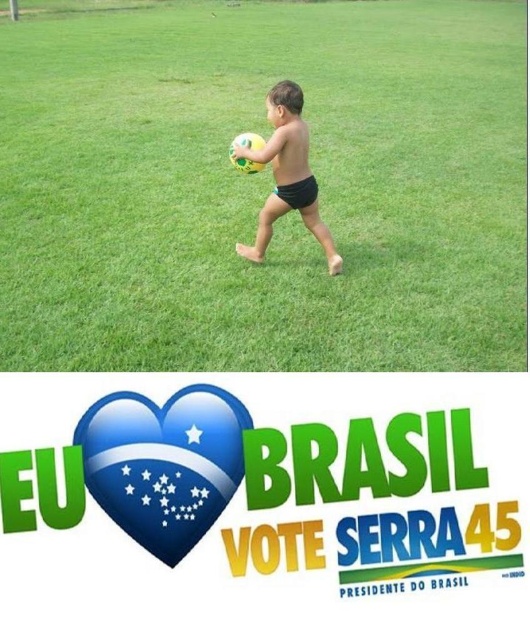
Where is `green grass at center`? Image resolution: width=530 pixels, height=640 pixels. green grass at center is located at coordinates (263, 188).

Is point (416, 262) positioned before point (200, 480)?

No, (416, 262) is further to viewer.

At what (x,y) coordinates should I click in order to perform the action: click on green grass at center. Please return your answer as a coordinate pair (x, y). Looking at the image, I should click on (263, 188).

Is point (196, 420) positioned in front of point (290, 106)?

Yes, point (196, 420) is in front of point (290, 106).

The image size is (530, 640). What do you see at coordinates (163, 464) in the screenshot?
I see `blue glossy heart at center` at bounding box center [163, 464].

Who is more forward, (210, 513) or (335, 264)?

Point (210, 513) is more forward.

Where is `blue glossy heart at center`? blue glossy heart at center is located at coordinates (163, 464).

Measure the distance from green grass at center to matte yellow ball at center.

green grass at center is 21.93 feet away from matte yellow ball at center.

Does green grass at center have a lesser height compared to matte yellow ball at center?

Incorrect, green grass at center's height does not fall short of matte yellow ball at center's.

This screenshot has height=640, width=530. What are the coordinates of `green grass at center` in the screenshot? It's located at (263, 188).

At what (x,y) coordinates should I click in order to perform the action: click on green grass at center. Please return your answer as a coordinate pair (x, y). The width and height of the screenshot is (530, 640). Looking at the image, I should click on (263, 188).